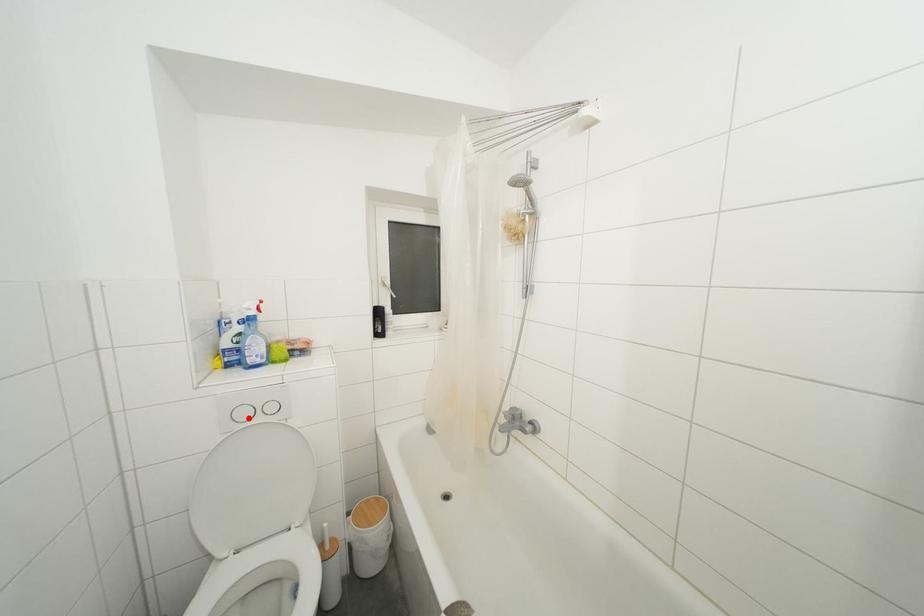
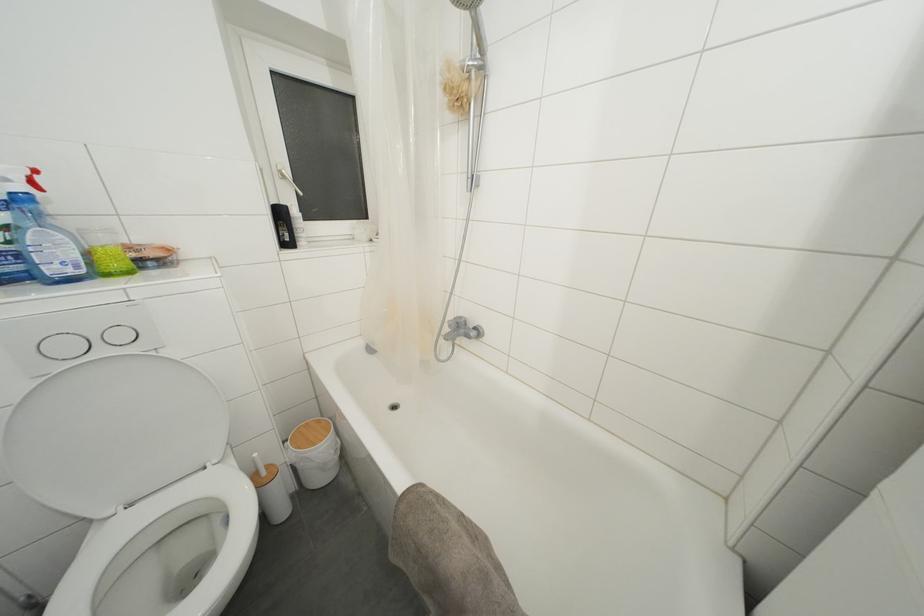
Find the pixel in the second image that matches the highlighted location in the first image.

(71, 352)